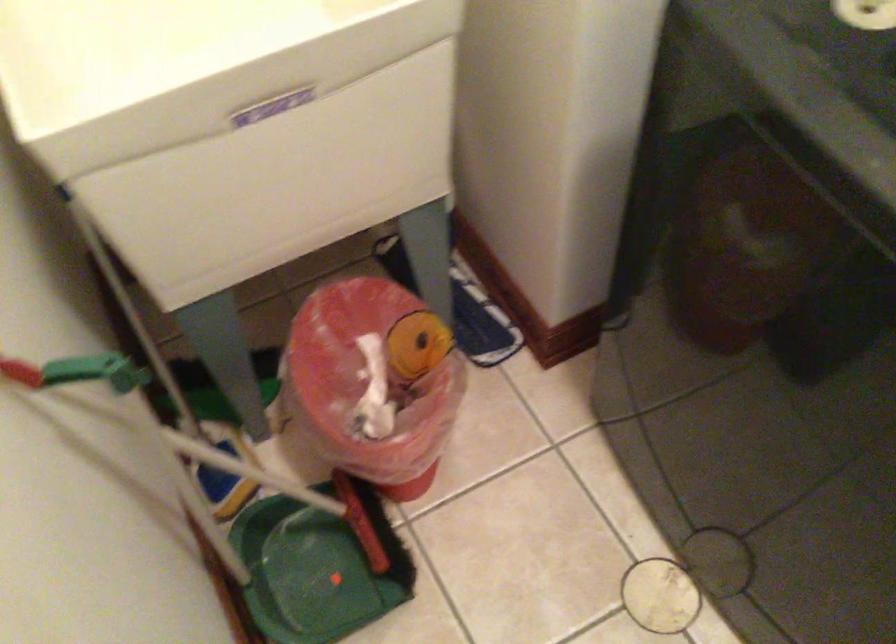
Where would you grip the red brush handle? Please return your answer as a coordinate pair (x, y).

(90, 415)